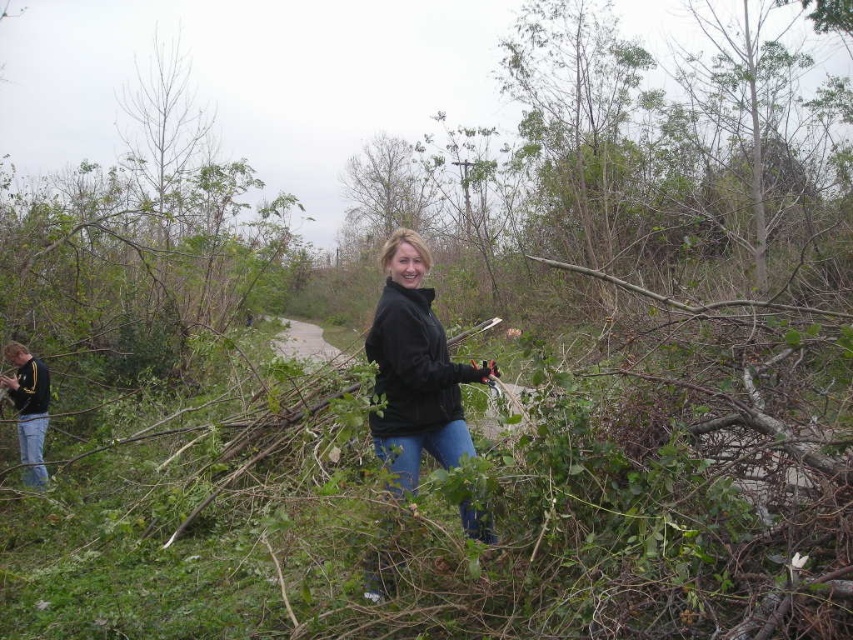
You are a fashion designer observing the outdoor scene. You need to determine which clothing item from the image is taller when viewed from the front. Which one is taller between the black matte jacket at center and the jeans at left?

The black matte jacket at center is much taller than the jeans at left.

You are trying to locate the black matte jacket at center and the jeans at left in the image. According to the scene description, which object is positioned to the right of the other?

The black matte jacket at center is to the right of jeans at left.